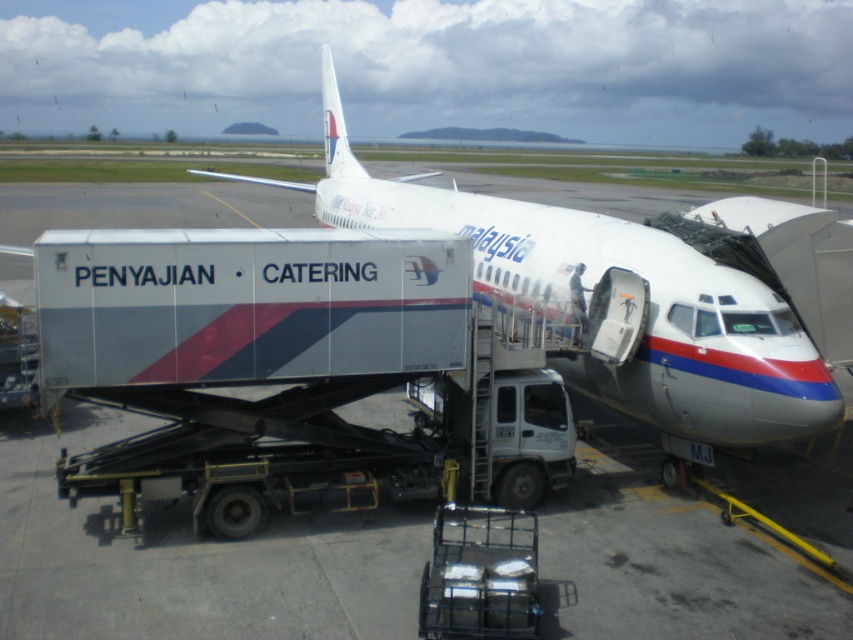
Which of these two, white glossy catering truck at center or white glossy airplane at center, stands taller?

Standing taller between the two is white glossy airplane at center.

In the scene shown: Which is more to the left, white glossy catering truck at center or white glossy airplane at center?

Positioned to the left is white glossy airplane at center.

Describe the element at coordinates (189, 573) in the screenshot. This screenshot has width=853, height=640. I see `white glossy catering truck at center` at that location.

I want to click on white glossy catering truck at center, so click(x=189, y=573).